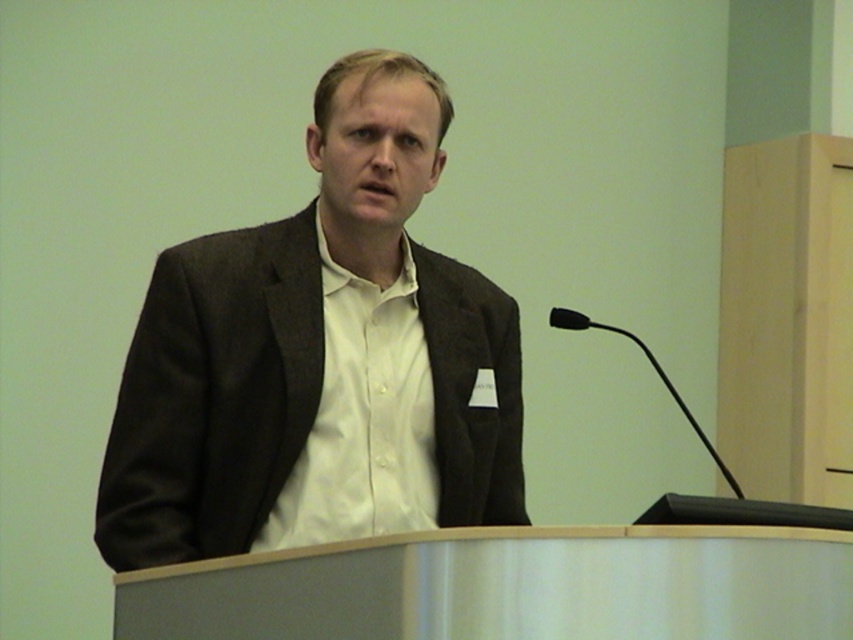
You are an event planner checking the speaker attire. According to the image, is the matte black suit at center covering the white smooth shirt at center?

The matte black suit at center is above the white smooth shirt at center, so the suit is covering the shirt.

In the scene shown: You are a fashion designer observing a man wearing a matte black suit at center and a white smooth shirt at center. Which clothing item is wider?

The matte black suit at center is wider than the white smooth shirt at center.